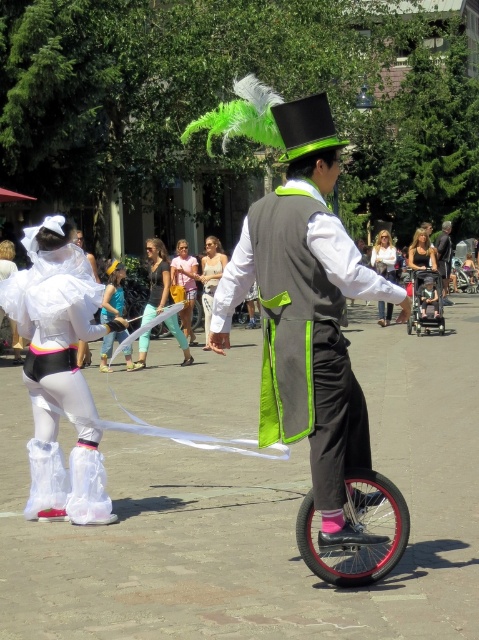
Can you confirm if matte gray vest at center is smaller than shiny metallic monocycle at center?

Correct, matte gray vest at center occupies less space than shiny metallic monocycle at center.

Which is in front, point (223, 301) or point (412, 305)?

Point (223, 301)

Where is `matte gray vest at center`? matte gray vest at center is located at coordinates (345, 260).

Identify the location of matte gray vest at center. This screenshot has height=640, width=479. (345, 260).

Is point (358, 268) positioned in front of point (444, 280)?

Yes, point (358, 268) is closer to viewer.

This screenshot has width=479, height=640. What do you see at coordinates (345, 260) in the screenshot?
I see `matte gray vest at center` at bounding box center [345, 260].

At what (x,y) coordinates should I click in order to perform the action: click on matte gray vest at center. Please return your answer as a coordinate pair (x, y). The width and height of the screenshot is (479, 640). Looking at the image, I should click on (345, 260).

Does white satin skirt at lower left appear on the left side of matte gray vest at center?

Correct, you'll find white satin skirt at lower left to the left of matte gray vest at center.

Does white satin skirt at lower left appear on the right side of matte gray vest at center?

Incorrect, white satin skirt at lower left is not on the right side of matte gray vest at center.

Does point (53, 333) come farther from viewer compared to point (307, 228)?

Yes, it is.

Image resolution: width=479 pixels, height=640 pixels. I want to click on white satin skirt at lower left, so click(x=59, y=372).